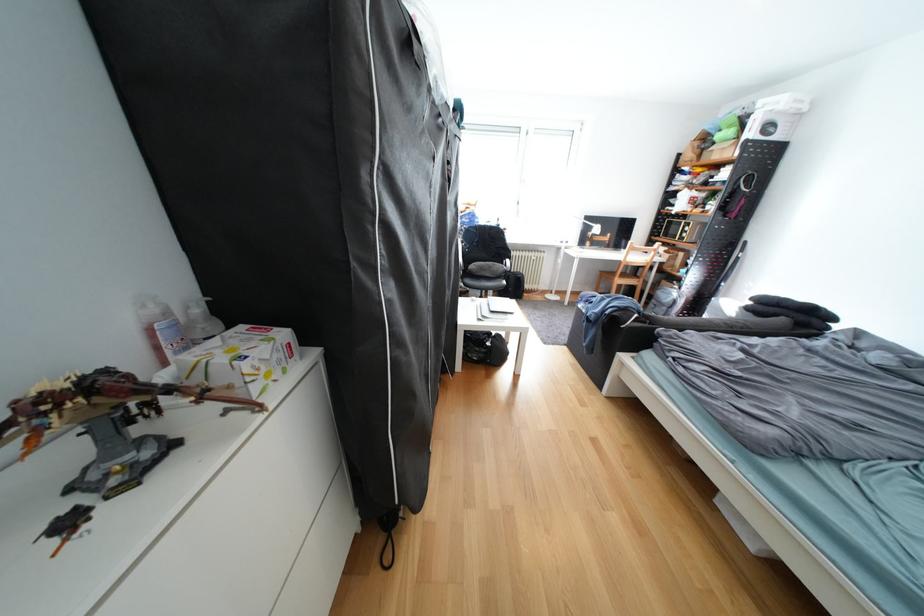
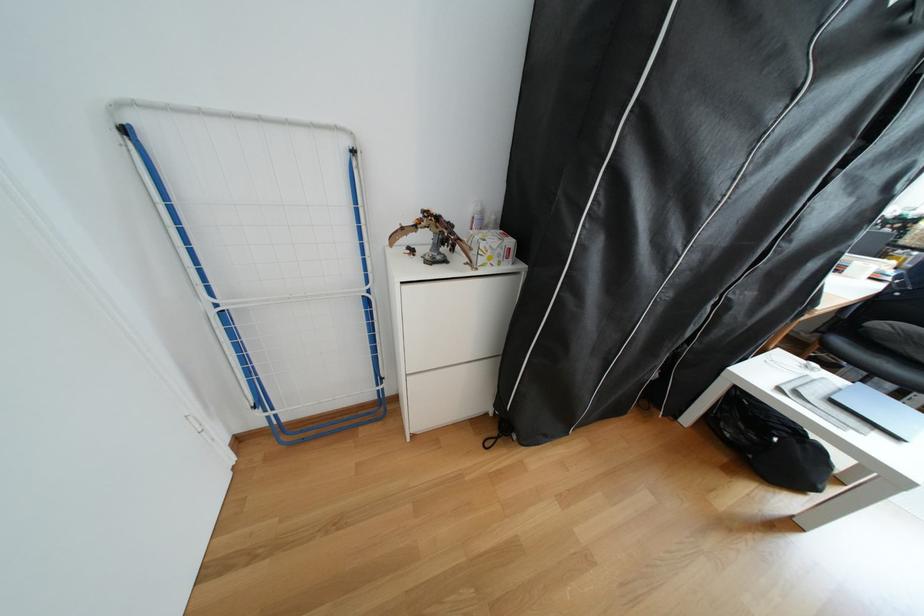
Question: I am providing you with two images of the same scene from different viewpoints. Please identify which objects are invisible in image2.

Choices:
 (A) dragon figurine
 (B) white cabinet drawer
 (C) black backpack
 (D) none of these

Answer: (D)